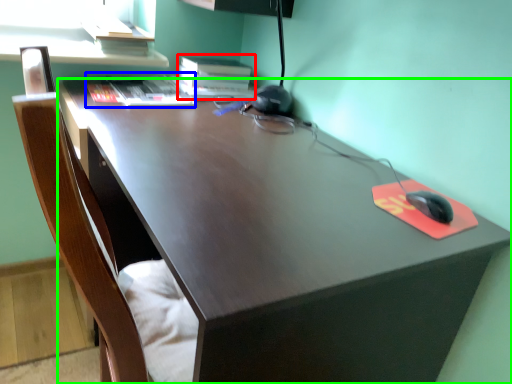
Question: Estimate the real-world distances between objects in this image. Which object is farther from book (highlighted by a red box), book (highlighted by a blue box) or desk (highlighted by a green box)?

Choices:
 (A) book
 (B) desk

Answer: (B)